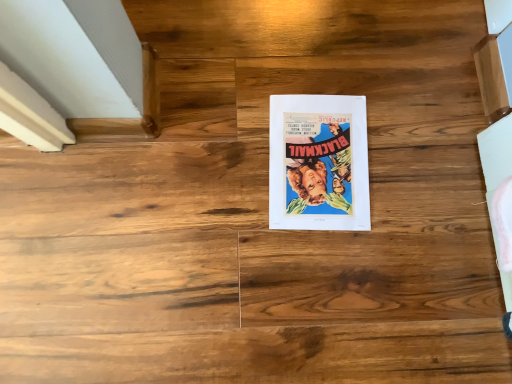
Question: Should I look upward or downward to see vibrant paper poster at center?

Choices:
 (A) up
 (B) down

Answer: (A)